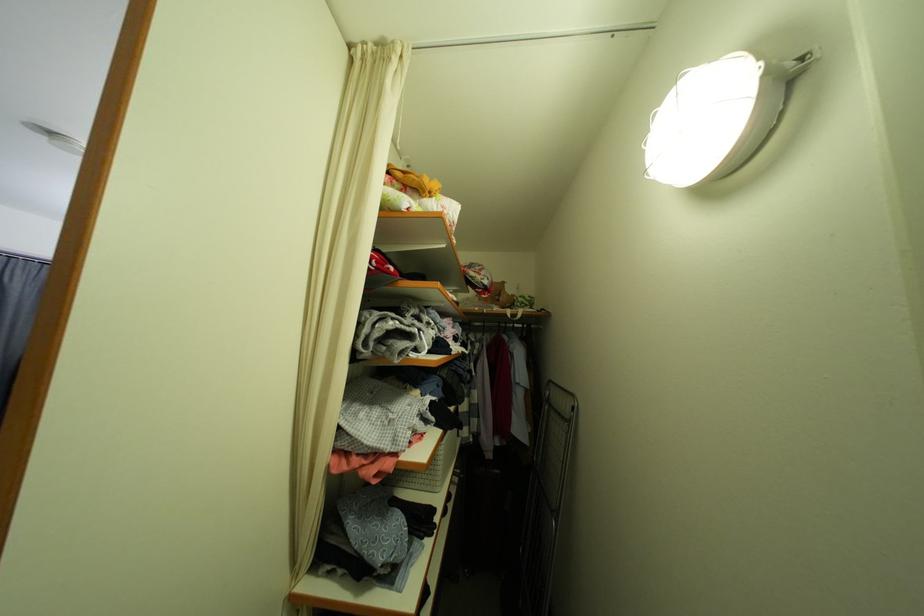
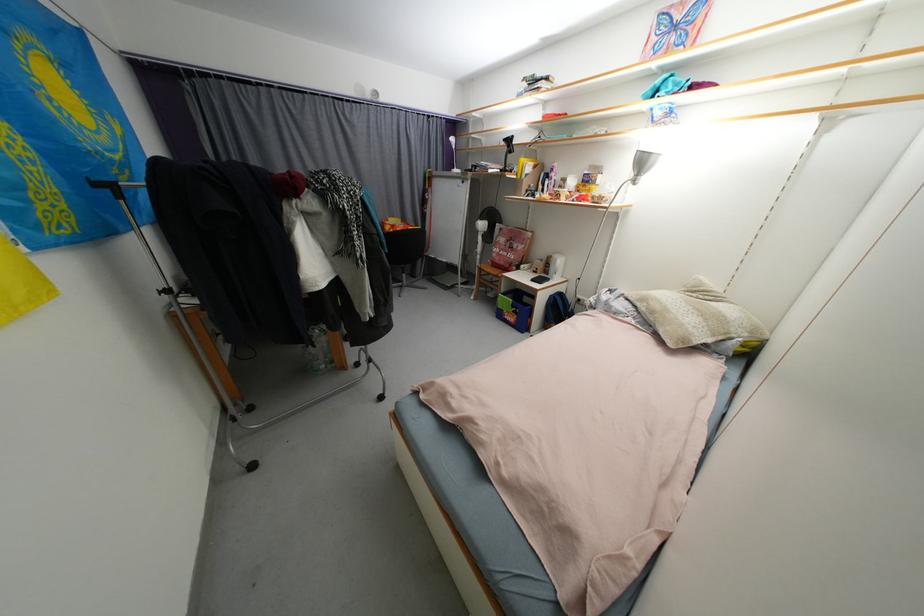
First-person continuous shooting, in which direction is the camera rotating?

The camera's rotation is toward left-down.